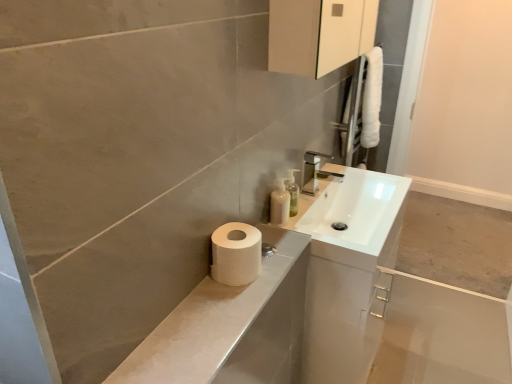
Where is `free space in front of white matte toilet paper at lower left`? This screenshot has height=384, width=512. free space in front of white matte toilet paper at lower left is located at coordinates (214, 315).